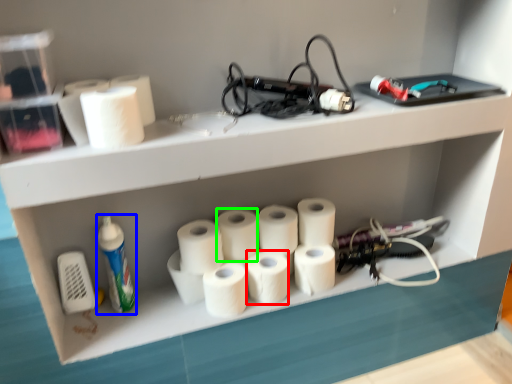
Question: Which is nearer to the paper towel (highlighted by a red box)? cleaning product (highlighted by a blue box) or paper towel (highlighted by a green box).

Choices:
 (A) cleaning product
 (B) paper towel

Answer: (B)